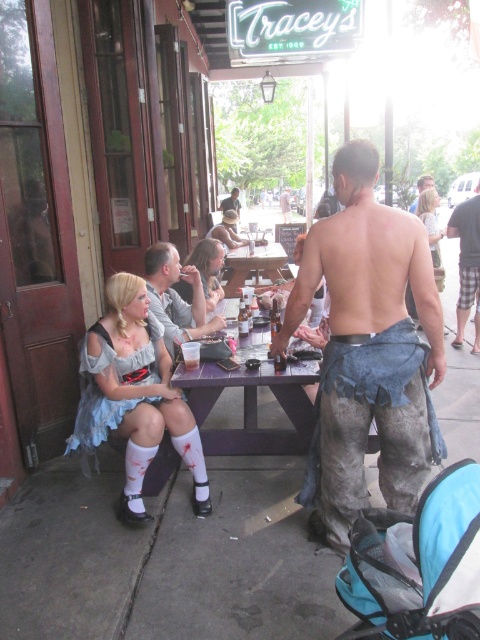
You are a photographer standing at the entrance of Tracey s. You want to take a photo of the purple wood table at center and the matte gray shirt at center. Based on their positions, which object is located to the right of the other?

The purple wood table at center is positioned on the right side of matte gray shirt at center, so the purple wood table at center is to the right of the matte gray shirt at center.

You are standing at the entrance of Tracey s and want to find the plaid shorts at right. Based on the coordinates provided in the Objects Description, in which general direction should you look to locate them?

The plaid shorts at right is located at point (x=467, y=264), which corresponds to the lower right area of the image. Therefore, you should look towards the lower right direction to find them.

You are standing at the entrance of Tracey s and want to place a 10 foot long banner between the plaid shorts at right and the smooth leather jacket at center. Is there enough space?

The plaid shorts at right is 20.44 feet from the smooth leather jacket at center, so yes, the banner can be placed between them since the distance is more than enough to accommodate its length.